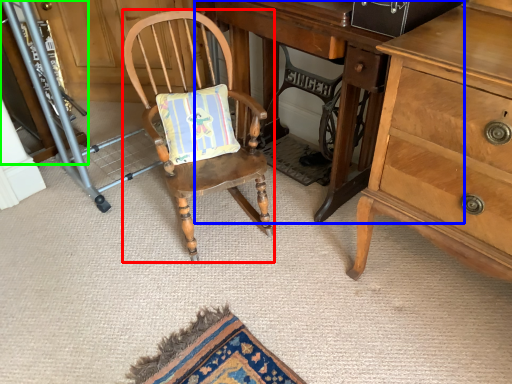
Question: Considering the real-world distances, which object is farthest from chair (highlighted by a red box)? desk (highlighted by a blue box) or cabinetry (highlighted by a green box)?

Choices:
 (A) desk
 (B) cabinetry

Answer: (B)